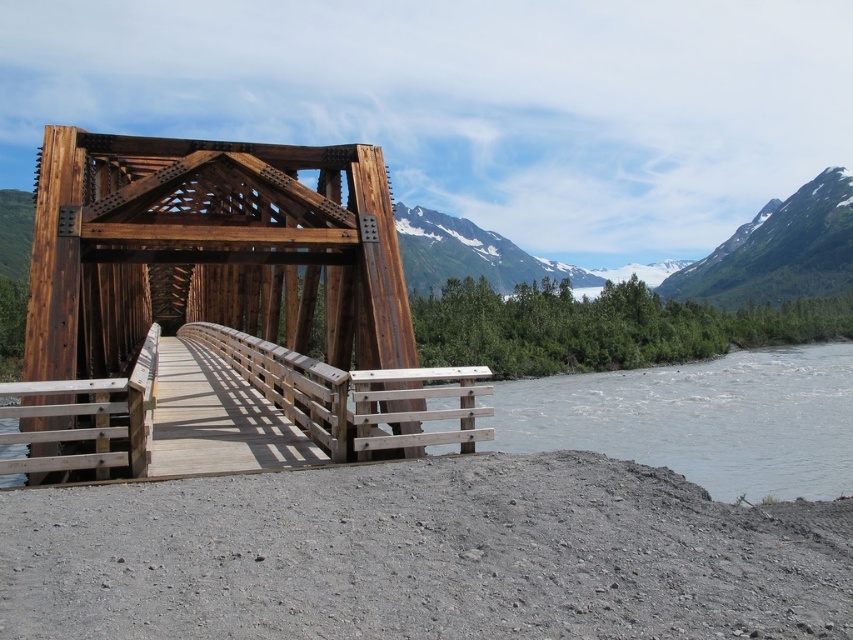
Can you confirm if matte brown wooden bridge at center is bigger than green forested mountain at upper right?

Incorrect, matte brown wooden bridge at center is not larger than green forested mountain at upper right.

Who is lower down, matte brown wooden bridge at center or green forested mountain at upper right?

Positioned lower is matte brown wooden bridge at center.

Between point (155, 221) and point (767, 259), which one is positioned behind?

The point (767, 259) is behind.

What are the coordinates of `matte brown wooden bridge at center` in the screenshot? It's located at (219, 300).